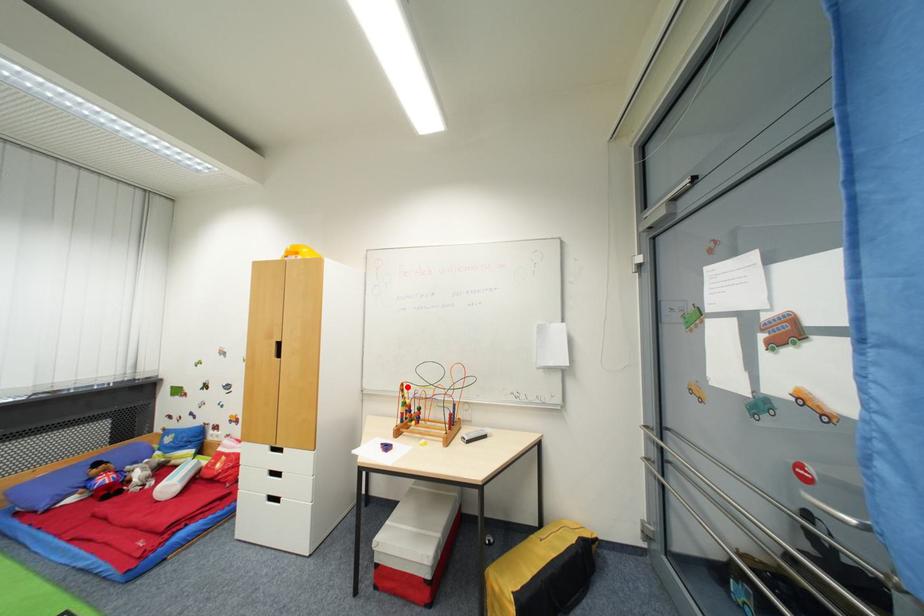
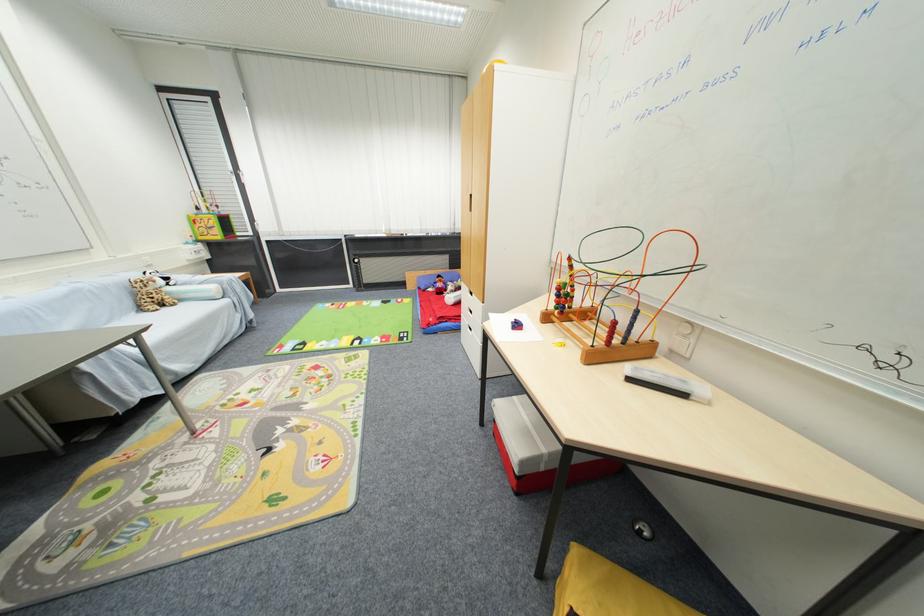
Find the pixel in the second image that matches the highlighted location in the first image.

(575, 261)